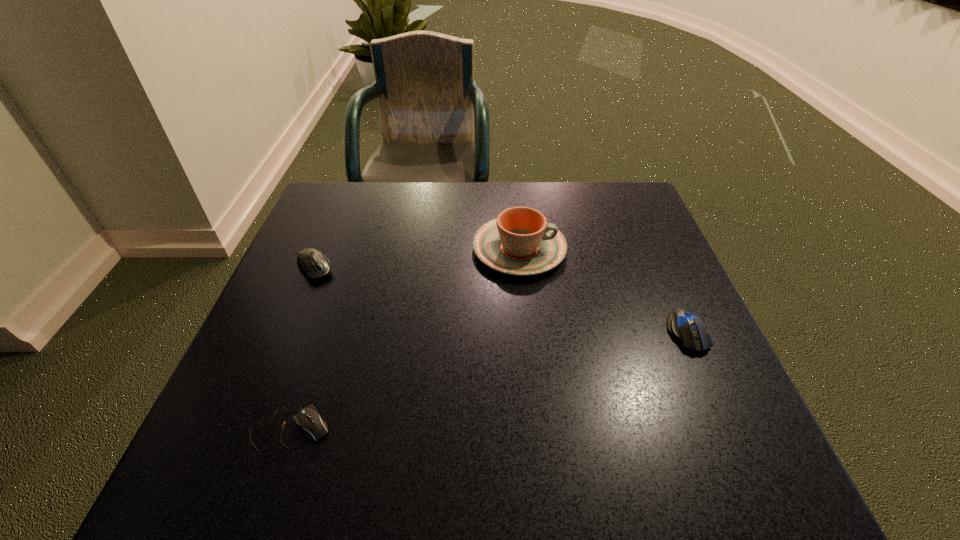
This screenshot has width=960, height=540. I want to click on free space located on the button side of the second shortest computer mouse, so click(x=750, y=475).

Find the location of a particular element. blank space located 0.390m on the right of the nearest object is located at coordinates (562, 427).

The width and height of the screenshot is (960, 540). I want to click on object that is positioned at the far edge, so click(520, 242).

The height and width of the screenshot is (540, 960). In order to click on object that is positioned at the near edge in this screenshot , I will do `click(308, 418)`.

Locate an element on the screen. The image size is (960, 540). object that is at the right edge is located at coordinates (683, 325).

The width and height of the screenshot is (960, 540). What are the coordinates of `object positioned at the near left corner` in the screenshot? It's located at (308, 418).

At what (x,y) coordinates should I click in order to perform the action: click on vacant space at the far edge of the desktop. Please return your answer as a coordinate pair (x, y). The height and width of the screenshot is (540, 960). Looking at the image, I should click on (578, 228).

Locate an element on the screen. This screenshot has width=960, height=540. vacant area at the near edge is located at coordinates (404, 481).

Identify the location of free space at the left edge of the desktop. This screenshot has height=540, width=960. (265, 307).

I want to click on vacant region at the right edge of the desktop, so click(x=655, y=243).